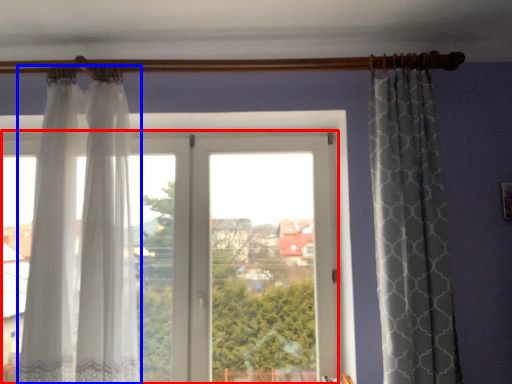
Question: Which object appears closest to the camera in this image, window (highlighted by a red box) or curtain (highlighted by a blue box)?

Choices:
 (A) window
 (B) curtain

Answer: (B)